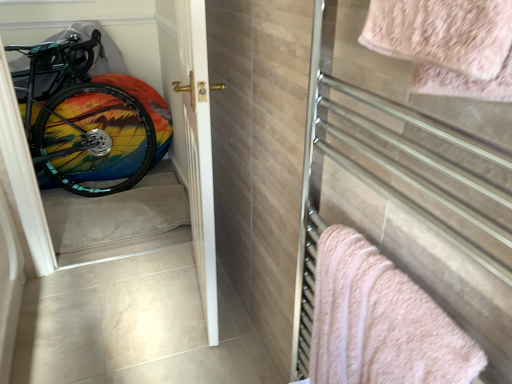
Question: Is white glossy door at center positioned before pink fluffy towel at upper right, the first towel in the top-to-bottom sequence?

Choices:
 (A) no
 (B) yes

Answer: (A)

Question: Is white glossy door at center at the right side of pink fluffy towel at upper right, which ranks as the second towel in back-to-front order?

Choices:
 (A) yes
 (B) no

Answer: (B)

Question: Is white glossy door at center turned away from pink fluffy towel at upper right, the second towel in the bottom-to-top sequence?

Choices:
 (A) yes
 (B) no

Answer: (B)

Question: Considering the relative sizes of white glossy door at center and pink fluffy towel at upper right, the second towel in the bottom-to-top sequence, in the image provided, is white glossy door at center thinner than pink fluffy towel at upper right, the second towel in the bottom-to-top sequence,?

Choices:
 (A) yes
 (B) no

Answer: (B)

Question: Is white glossy door at center wider than pink fluffy towel at upper right, the second towel in the bottom-to-top sequence?

Choices:
 (A) no
 (B) yes

Answer: (B)

Question: Is carpeted stairwell at left in front of or behind metallic towel rack at right in the image?

Choices:
 (A) behind
 (B) front

Answer: (A)

Question: Is point (141, 215) closer or farther from the camera than point (295, 365)?

Choices:
 (A) closer
 (B) farther

Answer: (B)

Question: In terms of height, does carpeted stairwell at left look taller or shorter compared to metallic towel rack at right?

Choices:
 (A) tall
 (B) short

Answer: (B)

Question: In the image, is carpeted stairwell at left on the left side or the right side of metallic towel rack at right?

Choices:
 (A) right
 (B) left

Answer: (B)

Question: Based on their positions, is white glossy door at center located to the left or right of pink fluffy towel at right, which is the first towel from bottom to top?

Choices:
 (A) right
 (B) left

Answer: (B)

Question: From the image's perspective, is white glossy door at center above or below pink fluffy towel at right, acting as the 1th towel starting from the back?

Choices:
 (A) above
 (B) below

Answer: (A)

Question: Is white glossy door at center wider or thinner than pink fluffy towel at right, which is the first towel from bottom to top?

Choices:
 (A) thin
 (B) wide

Answer: (B)

Question: Is point (186, 82) closer or farther from the camera than point (441, 340)?

Choices:
 (A) closer
 (B) farther

Answer: (B)

Question: Is carpeted stairwell at left inside or outside of white glossy door at center?

Choices:
 (A) inside
 (B) outside

Answer: (B)

Question: From their relative heights in the image, would you say carpeted stairwell at left is taller or shorter than white glossy door at center?

Choices:
 (A) tall
 (B) short

Answer: (B)